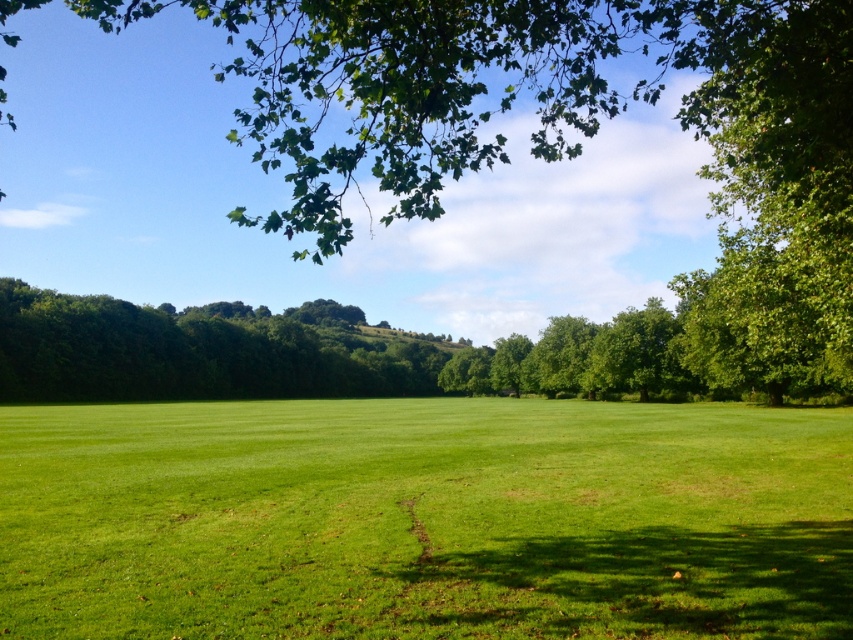
Who is taller, green grass at center or green leafy tree at upper center?

Standing taller between the two is green leafy tree at upper center.

What do you see at coordinates (424, 518) in the screenshot? I see `green grass at center` at bounding box center [424, 518].

This screenshot has width=853, height=640. What are the coordinates of `green grass at center` in the screenshot? It's located at click(424, 518).